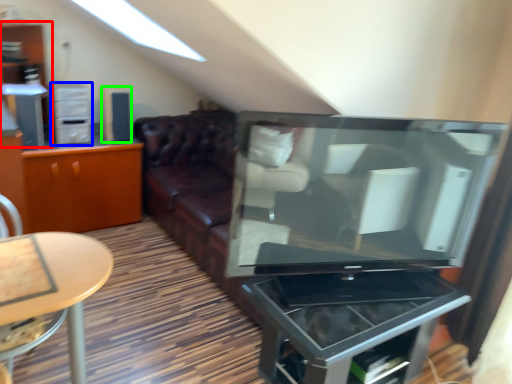
Question: Which object is the farthest from dresser (highlighted by a red box)? Choose among these: tv cabinet (highlighted by a blue box) or appliance (highlighted by a green box).

Choices:
 (A) tv cabinet
 (B) appliance

Answer: (B)